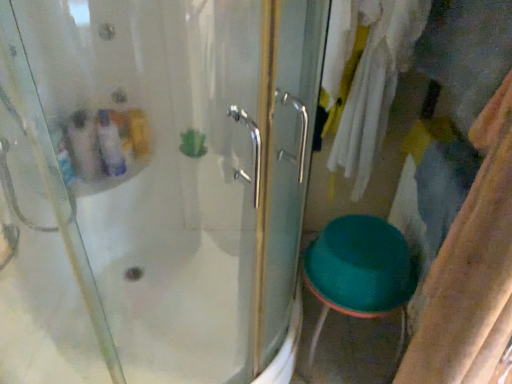
What do you see at coordinates (360, 273) in the screenshot? I see `teal plastic stool at lower right` at bounding box center [360, 273].

You are a GUI agent. You are given a task and a screenshot of the screen. Output one action in this format:
    pyautogui.click(x=<x>, y=<y>)
    Task: Click on the teal plastic stool at lower right
    
    Given the screenshot: What is the action you would take?
    pyautogui.click(x=360, y=273)

You are a GUI agent. You are given a task and a screenshot of the screen. Output one action in this format:
    pyautogui.click(x=<x>, y=<y>)
    Task: Click on the green plastic stool at lower right
    
    Given the screenshot: What is the action you would take?
    pyautogui.click(x=155, y=186)

Describe the element at coordinates (155, 186) in the screenshot. I see `green plastic stool at lower right` at that location.

What is the approximate height of green plastic stool at lower right?

1.37 meters.

Find the location of a particular element. teal plastic stool at lower right is located at coordinates (360, 273).

Which object is positioned more to the right, green plastic stool at lower right or teal plastic stool at lower right?

teal plastic stool at lower right.

Which is behind, green plastic stool at lower right or teal plastic stool at lower right?

teal plastic stool at lower right is further away from the camera.

Which is in front, point (197, 42) or point (362, 286)?

Point (197, 42)

In the scene shown: From the image's perspective, is green plastic stool at lower right on top of teal plastic stool at lower right?

Yes, from the image's perspective, green plastic stool at lower right is over teal plastic stool at lower right.

From a real-world perspective, which is physically below, green plastic stool at lower right or teal plastic stool at lower right?

teal plastic stool at lower right is physically lower.

Considering the relative sizes of green plastic stool at lower right and teal plastic stool at lower right in the image provided, is green plastic stool at lower right thinner than teal plastic stool at lower right?

No, green plastic stool at lower right is not thinner than teal plastic stool at lower right.

Is green plastic stool at lower right taller than teal plastic stool at lower right?

Yes.

Which of these two, green plastic stool at lower right or teal plastic stool at lower right, is bigger?

Bigger between the two is green plastic stool at lower right.

Is green plastic stool at lower right outside of teal plastic stool at lower right?

Yes, green plastic stool at lower right is outside of teal plastic stool at lower right.

Is green plastic stool at lower right far away from teal plastic stool at lower right?

green plastic stool at lower right is near teal plastic stool at lower right, not far away.

Based on the photo, is teal plastic stool at lower right at the back of green plastic stool at lower right?

No, green plastic stool at lower right is not facing the opposite direction of teal plastic stool at lower right.

Can you tell me how much green plastic stool at lower right and teal plastic stool at lower right differ in facing direction?

2.15 degrees.

Locate an element on the screen. The width and height of the screenshot is (512, 384). step stool below the green plastic stool at lower right (from the image's perspective) is located at coordinates (360, 273).

In the image, is teal plastic stool at lower right on the left side or the right side of green plastic stool at lower right?

In the image, teal plastic stool at lower right appears on the right side of green plastic stool at lower right.

Does teal plastic stool at lower right lie behind green plastic stool at lower right?

That is True.

Does point (333, 222) come farther from viewer compared to point (85, 333)?

No, it is in front of (85, 333).

From the image's perspective, is teal plastic stool at lower right located above or below green plastic stool at lower right?

From the image's perspective, teal plastic stool at lower right appears below green plastic stool at lower right.

From a real-world perspective, is teal plastic stool at lower right on green plastic stool at lower right?

No, from a real-world perspective, teal plastic stool at lower right is not on top of green plastic stool at lower right.

Which object is thinner, teal plastic stool at lower right or green plastic stool at lower right?

teal plastic stool at lower right is thinner.

Considering the sizes of objects teal plastic stool at lower right and green plastic stool at lower right in the image provided, who is shorter, teal plastic stool at lower right or green plastic stool at lower right?

teal plastic stool at lower right is shorter.

Considering the sizes of objects teal plastic stool at lower right and green plastic stool at lower right in the image provided, who is bigger, teal plastic stool at lower right or green plastic stool at lower right?

green plastic stool at lower right.

Would you say teal plastic stool at lower right contains green plastic stool at lower right?

Actually, green plastic stool at lower right is outside teal plastic stool at lower right.

Is teal plastic stool at lower right not near green plastic stool at lower right?

No, there isn't a large distance between teal plastic stool at lower right and green plastic stool at lower right.

Is green plastic stool at lower right at the back of teal plastic stool at lower right?

teal plastic stool at lower right is not turned away from green plastic stool at lower right.

What's the angular difference between teal plastic stool at lower right and green plastic stool at lower right's facing directions?

2.15 degrees.

Locate an element on the screen. step stool below the green plastic stool at lower right (from a real-world perspective) is located at coordinates (360, 273).

The height and width of the screenshot is (384, 512). I want to click on step stool on the right of green plastic stool at lower right, so click(x=360, y=273).

Identify the location of door that is above the teal plastic stool at lower right (from a real-world perspective). (155, 186).